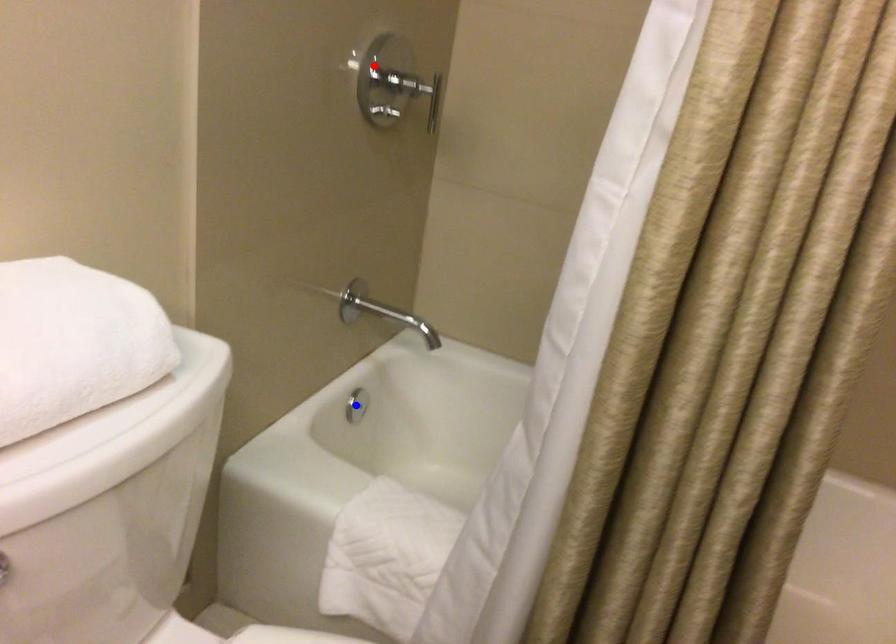
Question: In the image, two points are highlighted. Which point is nearer to the camera? Reply with the corresponding letter.

Choices:
 (A) blue point
 (B) red point

Answer: (B)